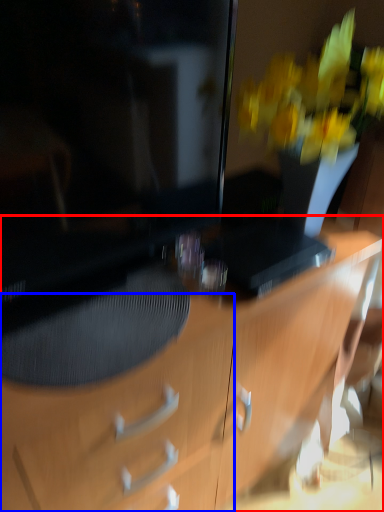
Question: Among these objects, which one is nearest to the camera, desk (highlighted by a red box) or drawer (highlighted by a blue box)?

Choices:
 (A) desk
 (B) drawer

Answer: (A)